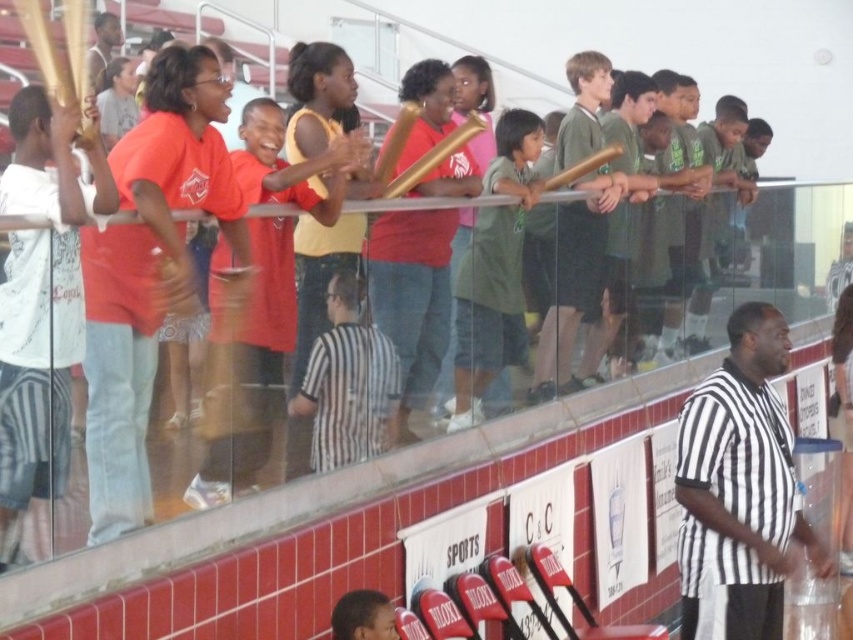
Question: Which object is farther from the camera taking this photo?

Choices:
 (A) matte red shirt at center
 (B) black and white striped shirt at center
 (C) green matte shirt at center

Answer: (C)

Question: Which point is farther to the camera?

Choices:
 (A) matte red shirt at center
 (B) green matte shirt at center

Answer: (B)

Question: Estimate the real-world distances between objects in this image. Which object is closer to the black and white striped shirt at center?

Choices:
 (A) matte red shirt at center
 (B) green matte shirt at center

Answer: (B)

Question: Can you confirm if matte red shirt at center is thinner than green matte shirt at center?

Choices:
 (A) yes
 (B) no

Answer: (B)

Question: Does matte red shirt at center have a lesser width compared to green matte shirt at center?

Choices:
 (A) yes
 (B) no

Answer: (B)

Question: Is matte red shirt at center positioned at the back of green matte shirt at center?

Choices:
 (A) yes
 (B) no

Answer: (B)